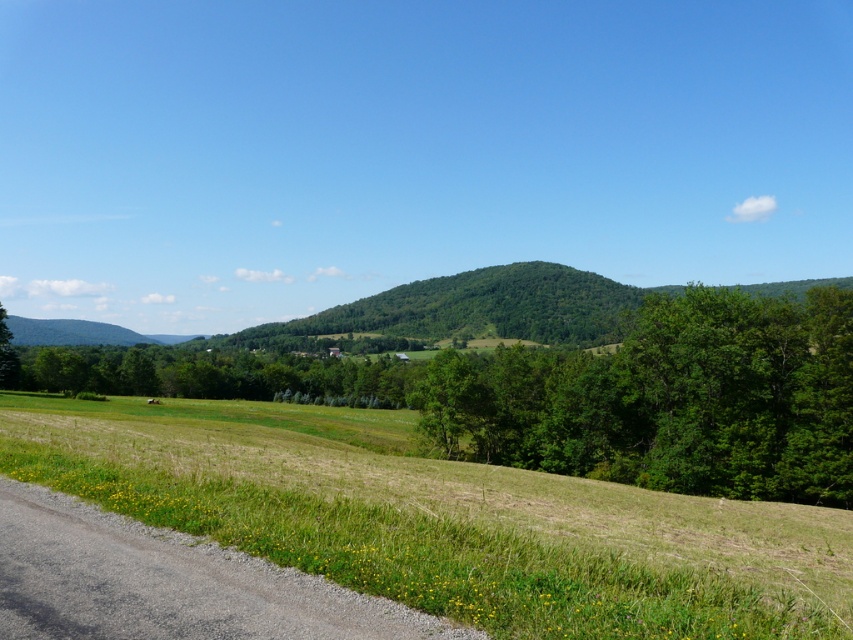
You are standing at the edge of the paved road and see the green leafy tree at center and the green leafy hill at center. Which one is closer to you?

The green leafy tree at center is closer to the viewer than the green leafy hill at center.

You are standing on the paved road in the image and want to walk to the green leafy hill at center. There is a green leafy tree at center blocking your path. Can you walk around it? Please explain.

The distance between the green leafy tree at center and the green leafy hill at center is 35.02 meters. Since the tree is blocking your path, you can walk around it as long as there is enough space. However, the description does not provide information about the tree trunk width or the available space around it to determine if it is feasible.

You are a hiker standing at the edge of the road and want to walk to the green leafy tree at center and the green leafy hill at center. Which one would you reach first?

The green leafy tree at center would be reached first because it is closer to the starting point than the green leafy hill at center, which is further away.